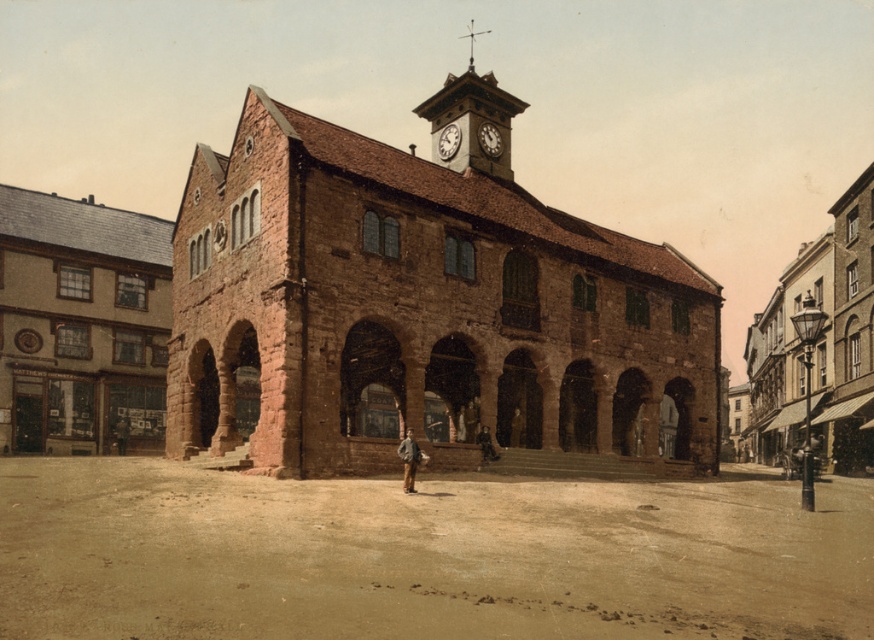
You are a drone operator who needs to fly a drone from the green stone clock tower at upper center to the white textured clock at upper center. What is the approximate distance you need to cover?

The distance between the green stone clock tower at upper center and the white textured clock at upper center is 126.22 meters, so the drone needs to cover approximately 126.22 meters.

You are standing in front of the historic building and want to locate the white textured clock at upper center. Based on the coordinates provided, where would you look relative to the building?

The white textured clock at upper center is located at coordinates point [448,140], which means it is positioned slightly to the left of the center horizontally and about halfway up the building vertically.